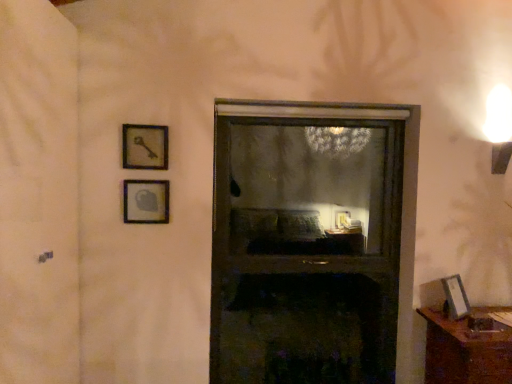
Question: Considering the relative positions of brown wooden table at lower right and transparent plastic screen door at left in the image provided, is brown wooden table at lower right to the right of transparent plastic screen door at left from the viewer's perspective?

Choices:
 (A) no
 (B) yes

Answer: (B)

Question: Is brown wooden table at lower right wider than transparent plastic screen door at left?

Choices:
 (A) no
 (B) yes

Answer: (B)

Question: Is brown wooden table at lower right facing away from transparent plastic screen door at left?

Choices:
 (A) no
 (B) yes

Answer: (A)

Question: Is brown wooden table at lower right closer to camera compared to transparent plastic screen door at left?

Choices:
 (A) no
 (B) yes

Answer: (A)

Question: Considering the relative sizes of brown wooden table at lower right and transparent plastic screen door at left in the image provided, is brown wooden table at lower right thinner than transparent plastic screen door at left?

Choices:
 (A) no
 (B) yes

Answer: (A)

Question: From the image's perspective, is brown wooden table at lower right located above transparent plastic screen door at left?

Choices:
 (A) no
 (B) yes

Answer: (A)

Question: Is brown wooden table at lower right at the back of matte silver picture frame at lower right, which is the third picture frame from top to bottom?

Choices:
 (A) no
 (B) yes

Answer: (A)

Question: Does matte silver picture frame at lower right, acting as the first picture frame starting from the bottom, come behind brown wooden table at lower right?

Choices:
 (A) yes
 (B) no

Answer: (A)

Question: Is matte silver picture frame at lower right, which ranks as the 3th picture frame in left-to-right order, wider than brown wooden table at lower right?

Choices:
 (A) yes
 (B) no

Answer: (B)

Question: Is matte silver picture frame at lower right, marked as the 1th picture frame in a right-to-left arrangement, to the left of brown wooden table at lower right from the viewer's perspective?

Choices:
 (A) no
 (B) yes

Answer: (B)

Question: From a real-world perspective, is matte silver picture frame at lower right, marked as the 1th picture frame in a right-to-left arrangement, below brown wooden table at lower right?

Choices:
 (A) yes
 (B) no

Answer: (B)

Question: Is matte silver picture frame at lower right, acting as the first picture frame starting from the bottom, far from brown wooden table at lower right?

Choices:
 (A) yes
 (B) no

Answer: (B)

Question: Can you confirm if wooden key at upper left, marked as the second picture frame in a left-to-right arrangement, is bigger than matte glass picture frame at upper left, the second picture frame from the top?

Choices:
 (A) yes
 (B) no

Answer: (A)